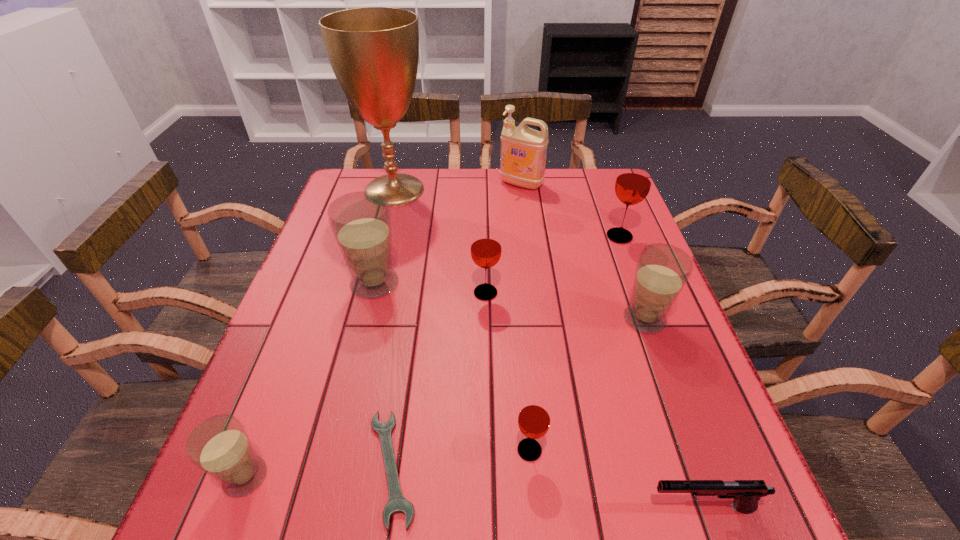
At what (x,y) coordinates should I click in order to perform the action: click on free spot at the left edge of the desktop. Please return your answer as a coordinate pair (x, y). Looking at the image, I should click on (281, 469).

The width and height of the screenshot is (960, 540). I want to click on blank space at the right edge, so click(x=708, y=457).

Identify the location of vacant space at the near left corner of the desktop. (205, 519).

Where is `vacant space at the far right corner of the desktop`? Image resolution: width=960 pixels, height=540 pixels. vacant space at the far right corner of the desktop is located at coordinates (570, 172).

You are a GUI agent. You are given a task and a screenshot of the screen. Output one action in this format:
    pyautogui.click(x=<x>, y=<y>)
    Task: Click on the empty space that is in between the biggest blue glass and the ninth tallest object
    
    Given the screenshot: What is the action you would take?
    pos(538,395)

Find the location of a particular element. The image size is (960, 540). free spot between the trophy cup and the gun is located at coordinates (548, 348).

The width and height of the screenshot is (960, 540). Identify the location of vacant space in between the detergent and the sixth object from right to left. (503, 238).

I want to click on vacant space in between the leftmost glass and the rightmost red glass, so click(432, 356).

Where is `vacant region between the trophy cup and the second red glass from right to left`? The height and width of the screenshot is (540, 960). vacant region between the trophy cup and the second red glass from right to left is located at coordinates (462, 320).

You are a GUI agent. You are given a task and a screenshot of the screen. Output one action in this format:
    pyautogui.click(x=<x>, y=<y>)
    Task: Click on the vacant point located between the second red glass from right to left and the gun
    The image size is (960, 540).
    Given the screenshot: What is the action you would take?
    pyautogui.click(x=615, y=478)